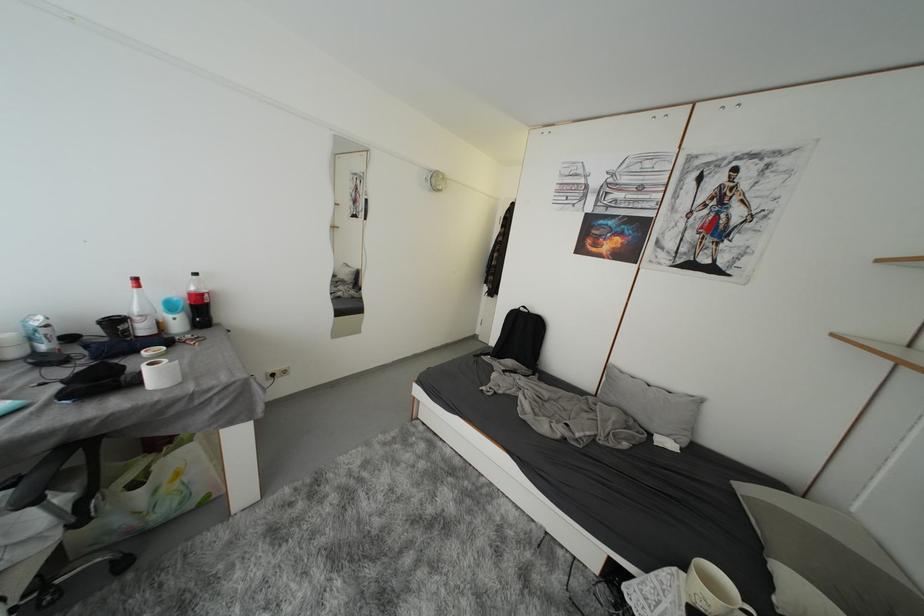
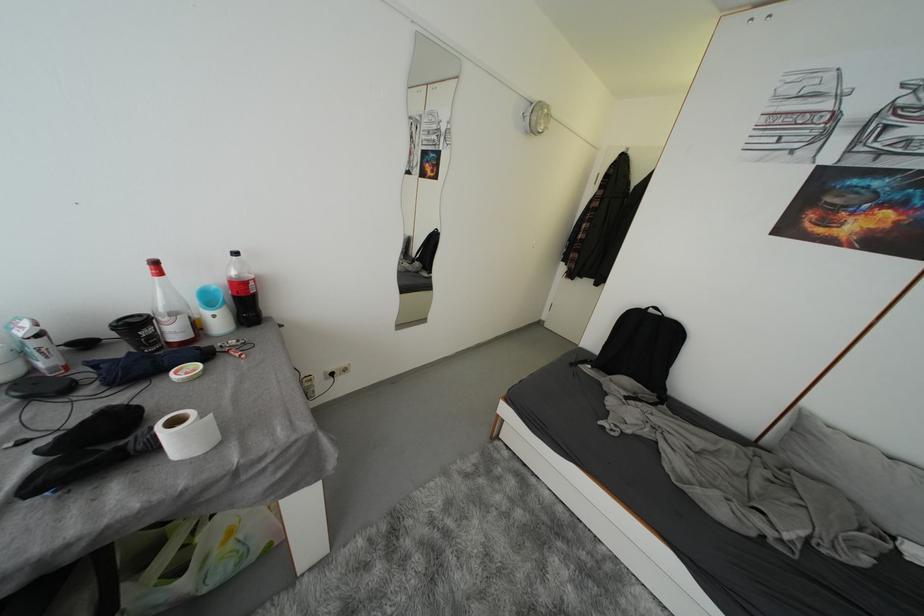
Question: How did the camera likely rotate?

Choices:
 (A) Left
 (B) Right
 (C) Up
 (D) Down

Answer: (D)